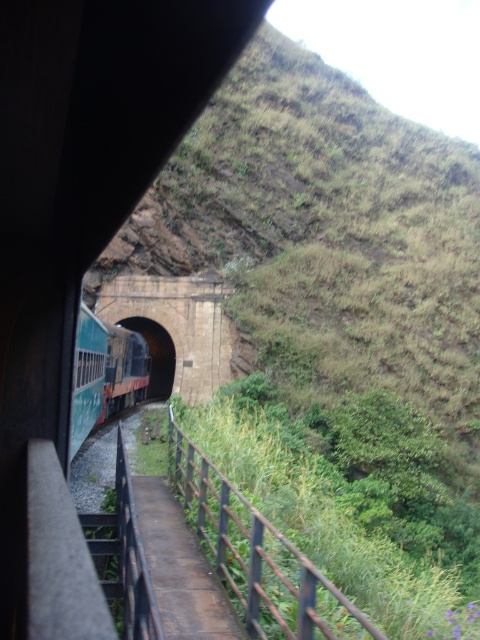
Question: Does brown metal rail at lower center appear over brick tunnel at center?

Choices:
 (A) yes
 (B) no

Answer: (B)

Question: Does brown metal rail at lower center appear under teal glossy passenger train at left?

Choices:
 (A) no
 (B) yes

Answer: (B)

Question: Is teal glossy passenger train at left below brick tunnel at center?

Choices:
 (A) yes
 (B) no

Answer: (B)

Question: Among these points, which one is nearest to the camera?

Choices:
 (A) (175, 432)
 (B) (148, 324)

Answer: (A)

Question: Based on their relative distances, which object is farther from the brown metal rail at lower center?

Choices:
 (A) brick tunnel at center
 (B) teal glossy passenger train at left

Answer: (A)

Question: Which point is closer to the camera?

Choices:
 (A) (156, 380)
 (B) (230, 522)
 (C) (107, 324)

Answer: (B)